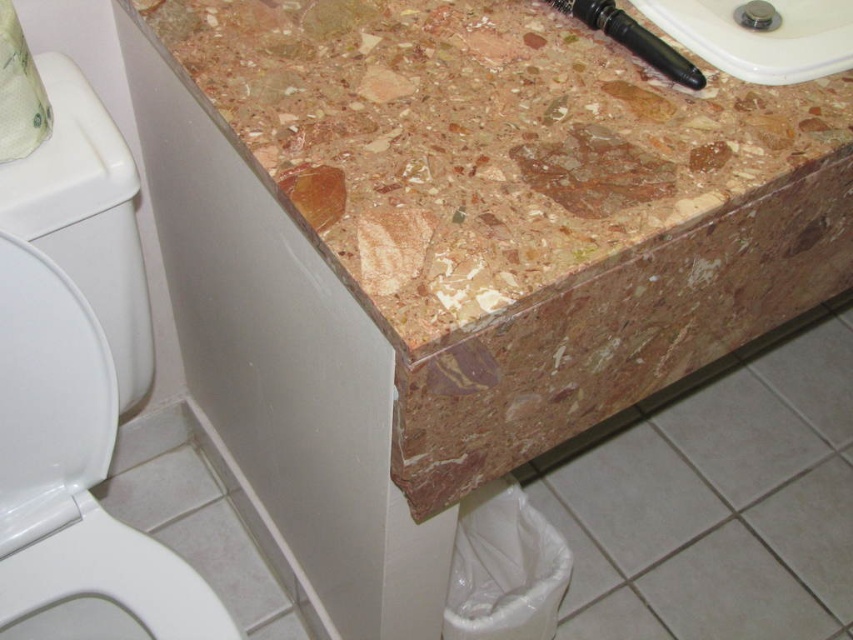
This screenshot has width=853, height=640. What do you see at coordinates (73, 474) in the screenshot? I see `white glossy toilet bowl at lower left` at bounding box center [73, 474].

Is white glossy toilet bowl at lower left smaller than matte brown sink at upper right?

Incorrect, white glossy toilet bowl at lower left is not smaller in size than matte brown sink at upper right.

Is point (152, 608) farther from camera compared to point (674, 26)?

Yes, point (152, 608) is farther from viewer.

Find the location of a particular element. white glossy toilet bowl at lower left is located at coordinates (73, 474).

Who is shorter, white glossy toilet bowl at lower left or matte metallic faucet at upper right?

Standing shorter between the two is matte metallic faucet at upper right.

Between white glossy toilet bowl at lower left and matte metallic faucet at upper right, which one is positioned higher?

matte metallic faucet at upper right is higher up.

Locate an element on the screen. white glossy toilet bowl at lower left is located at coordinates (73, 474).

Locate an element on the screen. The height and width of the screenshot is (640, 853). white glossy toilet bowl at lower left is located at coordinates click(x=73, y=474).

Is white glossy toilet bowl at lower left shorter than white paper towel at upper left?

No.

Who is more forward, [4,435] or [4,80]?

Point [4,80] is in front.

Identify the location of white glossy toilet bowl at lower left. (73, 474).